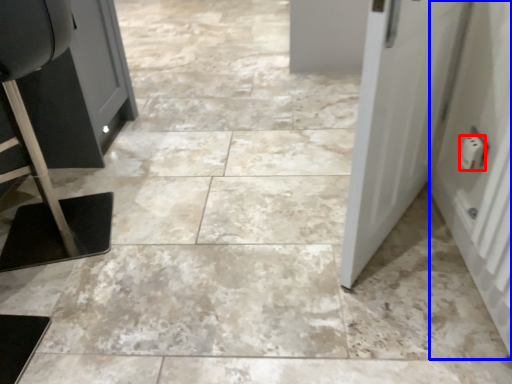
Question: Which point is closer to the camera, electric outlet (highlighted by a red box) or door (highlighted by a blue box)?

Choices:
 (A) electric outlet
 (B) door

Answer: (B)